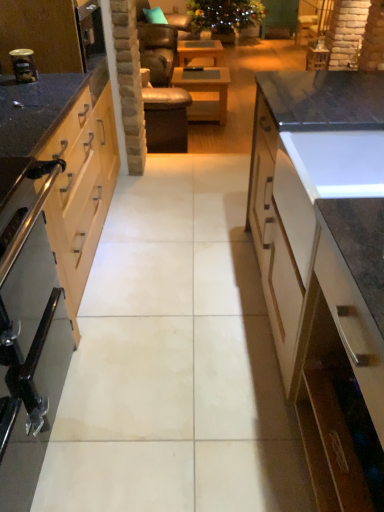
Measure the distance between point (307, 286) and camera.

Point (307, 286) and camera are 4.02 feet apart from each other.

Find the location of `metallic silver canister at left`. metallic silver canister at left is located at coordinates (23, 65).

The height and width of the screenshot is (512, 384). What do you see at coordinates (23, 65) in the screenshot? I see `metallic silver canister at left` at bounding box center [23, 65].

The height and width of the screenshot is (512, 384). What are the coordinates of `stainless steel oven at left` in the screenshot? It's located at (20, 333).

This screenshot has height=512, width=384. In order to click on wooden at center, the first table when ordered from bottom to top in this screenshot , I will do coord(205,93).

You are a GUI agent. You are given a task and a screenshot of the screen. Output one action in this format:
    pyautogui.click(x=<x>, y=<y>)
    Task: Click on the white glossy cabinet at right, arranged as the 1th cabinetry when viewed from the right
    This screenshot has height=512, width=384.
    Given the screenshot: What is the action you would take?
    pyautogui.click(x=323, y=257)

From a real-world perspective, is white glossy cabinet at right, arranged as the 1th cabinetry when viewed from the right, physically located above or below metallic silver toaster at left?

In terms of real-world spatial position, white glossy cabinet at right, arranged as the 1th cabinetry when viewed from the right, is below metallic silver toaster at left.

Between white glossy cabinet at right, arranged as the 1th cabinetry when viewed from the right, and metallic silver toaster at left, which one appears on the left side from the viewer's perspective?

metallic silver toaster at left.

Could you tell me if white glossy cabinet at right, the 2th cabinetry viewed from the left, is facing metallic silver toaster at left?

No, white glossy cabinet at right, the 2th cabinetry viewed from the left, is not aimed at metallic silver toaster at left.

From the image's perspective, which is above, white glossy cabinet at right, arranged as the 1th cabinetry when viewed from the right, or metallic silver toaster at left?

metallic silver toaster at left is shown above in the image.

Is metallic silver canister at left closer to the viewer compared to light wood cabinet at left, arranged as the 1th cabinetry when viewed from the left?

No, it is not.

Is light wood cabinet at left, arranged as the 1th cabinetry when viewed from the left, inside metallic silver canister at left?

Definitely not — light wood cabinet at left, arranged as the 1th cabinetry when viewed from the left, is not inside metallic silver canister at left.

From a real-world perspective, is metallic silver canister at left physically located above or below light wood cabinet at left, arranged as the 1th cabinetry when viewed from the left?

In terms of real-world spatial position, metallic silver canister at left is above light wood cabinet at left, arranged as the 1th cabinetry when viewed from the left.

Is wooden at center, which appears as the 2th table when viewed from the top, to the left or to the right of light wood cabinet at left, arranged as the 1th cabinetry when viewed from the left, in the image?

wooden at center, which appears as the 2th table when viewed from the top, is positioned on light wood cabinet at left, arranged as the 1th cabinetry when viewed from the left,'s right side.

From a real-world perspective, is wooden at center, which appears as the 2th table when viewed from the back, on light wood cabinet at left, which ranks as the second cabinetry in right-to-left order?

No.

In the scene shown: Is wooden at center, the first table when ordered from bottom to top, situated inside light wood cabinet at left, arranged as the 1th cabinetry when viewed from the left, or outside?

The correct answer is: outside.

Based on the photo, is the depth of wooden at center, the first table when ordered from bottom to top, greater than that of light wood cabinet at left, which ranks as the second cabinetry in right-to-left order?

Yes.

Is stainless steel oven at left next to wooden table at center, the 2th table viewed from the front, and touching it?

No, stainless steel oven at left is not next to wooden table at center, the 2th table viewed from the front.

How many degrees apart are the facing directions of stainless steel oven at left and wooden table at center, the second table from the bottom?

The angle between the facing direction of stainless steel oven at left and the facing direction of wooden table at center, the second table from the bottom, is 1.3 degrees.

From the image's perspective, does stainless steel oven at left appear higher than wooden table at center, the second table from the bottom?

No, from the image's perspective, stainless steel oven at left is not above wooden table at center, the second table from the bottom.

Who is taller, stainless steel oven at left or wooden table at center, the 2th table viewed from the front?

Standing taller between the two is stainless steel oven at left.

Would you consider light wood cabinet at left, which ranks as the second cabinetry in right-to-left order, to be distant from white glossy cabinet at right, arranged as the 1th cabinetry when viewed from the right?

No, light wood cabinet at left, which ranks as the second cabinetry in right-to-left order, is in close proximity to white glossy cabinet at right, arranged as the 1th cabinetry when viewed from the right.

From a real-world perspective, is light wood cabinet at left, which ranks as the second cabinetry in right-to-left order, above or below white glossy cabinet at right, arranged as the 1th cabinetry when viewed from the right?

In terms of real-world spatial position, light wood cabinet at left, which ranks as the second cabinetry in right-to-left order, is above white glossy cabinet at right, arranged as the 1th cabinetry when viewed from the right.

Consider the image. Is light wood cabinet at left, arranged as the 1th cabinetry when viewed from the left, thinner than white glossy cabinet at right, the 2th cabinetry viewed from the left?

Yes, light wood cabinet at left, arranged as the 1th cabinetry when viewed from the left, is thinner than white glossy cabinet at right, the 2th cabinetry viewed from the left.

Between point (74, 136) and point (343, 504), which one is positioned behind?

Point (74, 136)

Is metallic silver canister at left to the right of wooden at center, which appears as the 2th table when viewed from the back, from the viewer's perspective?

In fact, metallic silver canister at left is to the left of wooden at center, which appears as the 2th table when viewed from the back.

Can you tell me how much metallic silver canister at left and wooden at center, the first table when ordered from bottom to top, differ in facing direction?

2.09 degrees.

Is metallic silver canister at left directly adjacent to wooden at center, which appears as the 2th table when viewed from the back?

They are not placed beside each other.

In the scene shown: How distant is metallic silver canister at left from wooden at center, which appears as the 2th table when viewed from the top?

metallic silver canister at left and wooden at center, which appears as the 2th table when viewed from the top, are 9.05 feet apart.

Does white glossy cabinet at right, the 2th cabinetry viewed from the left, appear on the left side of light wood cabinet at left, arranged as the 1th cabinetry when viewed from the left?

No.

In terms of width, does white glossy cabinet at right, the 2th cabinetry viewed from the left, look wider or thinner when compared to light wood cabinet at left, which ranks as the second cabinetry in right-to-left order?

white glossy cabinet at right, the 2th cabinetry viewed from the left, is wider than light wood cabinet at left, which ranks as the second cabinetry in right-to-left order.

From a real-world perspective, is white glossy cabinet at right, arranged as the 1th cabinetry when viewed from the right, beneath light wood cabinet at left, which ranks as the second cabinetry in right-to-left order?

Yes, from a real-world perspective, white glossy cabinet at right, arranged as the 1th cabinetry when viewed from the right, is below light wood cabinet at left, which ranks as the second cabinetry in right-to-left order.

Who is shorter, white glossy cabinet at right, the 2th cabinetry viewed from the left, or light wood cabinet at left, which ranks as the second cabinetry in right-to-left order?

Standing shorter between the two is light wood cabinet at left, which ranks as the second cabinetry in right-to-left order.

From the image's perspective, starting from the metallic silver toaster at left, which cabinetry is the 2nd one below? Please provide its 2D coordinates.

[(323, 257)]

Locate an element on the screen. the 1st cabinetry counting from the right of the metallic silver canister at left is located at coordinates (81, 191).

From the image, which object appears to be nearer to metallic silver toaster at left, teal fabric pillow at upper center or metallic silver canister at left?

metallic silver canister at left lies closer to metallic silver toaster at left than the other object.

Estimate the real-world distances between objects in this image. Which object is closer to light wood cabinet at left, which ranks as the second cabinetry in right-to-left order, metallic silver toaster at left or wooden table at center, the second table from the bottom?

metallic silver toaster at left is closer to light wood cabinet at left, which ranks as the second cabinetry in right-to-left order.

When comparing their distances from light wood cabinet at left, arranged as the 1th cabinetry when viewed from the left, does metallic silver canister at left or wooden table at center, the 2th table viewed from the front, seem closer?

metallic silver canister at left.

When comparing their distances from stainless steel oven at left, does wooden table at center, the 2th table viewed from the front, or metallic silver toaster at left seem further?

Among the two, wooden table at center, the 2th table viewed from the front, is located further to stainless steel oven at left.

From the image, which object appears to be nearer to light wood cabinet at left, which ranks as the second cabinetry in right-to-left order, wooden table at center, which is counted as the first table, starting from the top, or stainless steel oven at left?

stainless steel oven at left.

Considering their positions, is light wood cabinet at left, which ranks as the second cabinetry in right-to-left order, positioned further to stainless steel oven at left than teal fabric pillow at upper center?

The object further to stainless steel oven at left is teal fabric pillow at upper center.

Considering their positions, is metallic silver toaster at left positioned further to light wood cabinet at left, arranged as the 1th cabinetry when viewed from the left, than stainless steel oven at left?

Among the two, stainless steel oven at left is located further to light wood cabinet at left, arranged as the 1th cabinetry when viewed from the left.

Considering their positions, is white glossy cabinet at right, the 2th cabinetry viewed from the left, positioned further to wooden at center, which appears as the 2th table when viewed from the back, than light wood cabinet at left, which ranks as the second cabinetry in right-to-left order?

Based on the image, white glossy cabinet at right, the 2th cabinetry viewed from the left, appears to be further to wooden at center, which appears as the 2th table when viewed from the back.

I want to click on appliance located between light wood cabinet at left, arranged as the 1th cabinetry when viewed from the left, and wooden table at center, which is counted as the first table, starting from the top, in the depth direction, so click(x=23, y=65).

Identify the location of home appliance between white glossy cabinet at right, the 2th cabinetry viewed from the left, and wooden table at center, the 1th table positioned from the back, in the front-back direction. (20, 333).

You are a GUI agent. You are given a task and a screenshot of the screen. Output one action in this format:
    pyautogui.click(x=<x>, y=<y>)
    Task: Click on the home appliance between white glossy cabinet at right, the 2th cabinetry viewed from the left, and teal fabric pillow at upper center from front to back
    
    Given the screenshot: What is the action you would take?
    pyautogui.click(x=20, y=333)

Where is `appliance between light wood cabinet at left, arranged as the 1th cabinetry when viewed from the left, and wooden at center, which appears as the 2th table when viewed from the top, in the front-back direction`? The height and width of the screenshot is (512, 384). appliance between light wood cabinet at left, arranged as the 1th cabinetry when viewed from the left, and wooden at center, which appears as the 2th table when viewed from the top, in the front-back direction is located at coordinates (23, 65).